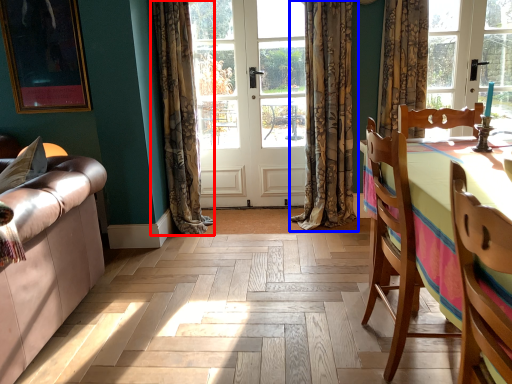
Question: Which point is further to the camera, curtain (highlighted by a red box) or curtain (highlighted by a blue box)?

Choices:
 (A) curtain
 (B) curtain

Answer: (B)